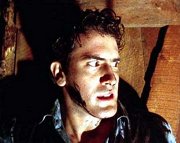
Locate an element on the screen. The width and height of the screenshot is (180, 143). brown walls is located at coordinates (167, 93).